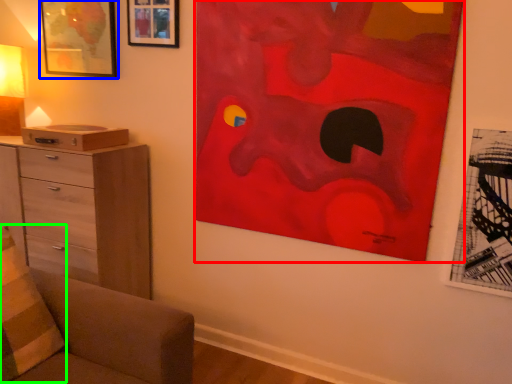
Question: Which is nearer to the art (highlighted by a red box)? picture frame (highlighted by a blue box) or pillow (highlighted by a green box).

Choices:
 (A) picture frame
 (B) pillow

Answer: (A)